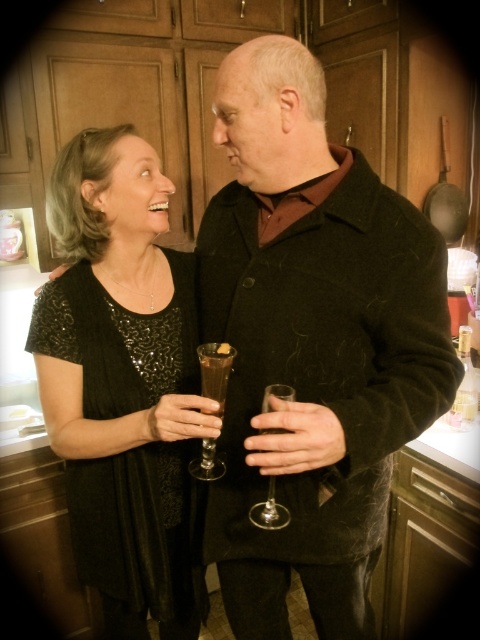
Can you confirm if brown glass at center is positioned above clear glass wine glass at center?

Indeed, brown glass at center is positioned over clear glass wine glass at center.

Does brown glass at center appear on the right side of clear glass wine glass at center?

In fact, brown glass at center is to the left of clear glass wine glass at center.

This screenshot has width=480, height=640. What are the coordinates of `brown glass at center` in the screenshot? It's located at (216, 371).

Who is positioned more to the right, black sequined dress at left or clear glass wine glass at center?

From the viewer's perspective, clear glass wine glass at center appears more on the right side.

Does black sequined dress at left have a lesser width compared to clear glass wine glass at center?

No.

Locate an element on the screen. The width and height of the screenshot is (480, 640). black sequined dress at left is located at coordinates point(121,380).

In order to click on black sequined dress at left in this screenshot , I will do `click(121, 380)`.

Looking at this image, does brown glass at center lie behind translucent glass at center?

Yes, brown glass at center is behind translucent glass at center.

Measure the distance between brown glass at center and translucent glass at center.

They are 0.52 inches apart.

Between point (204, 360) and point (212, 362), which one is positioned in front?

Positioned in front is point (212, 362).

This screenshot has width=480, height=640. Identify the location of brown glass at center. (216, 371).